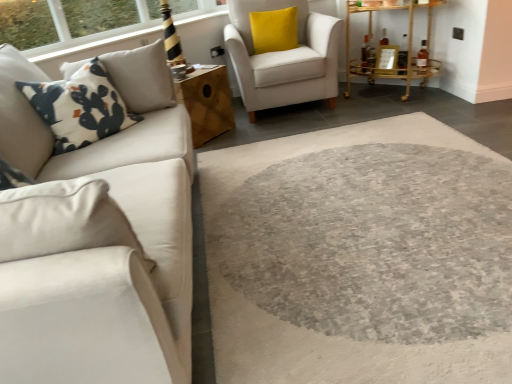
Question: In which direction should I rotate to look at wooden cube at center, the second table positioned from the right?

Choices:
 (A) left
 (B) right

Answer: (A)

Question: Would you consider gold metallic bar cart at upper right, which ranks as the 1th table in right-to-left order, to be distant from yellow velvet pillow at upper right?

Choices:
 (A) no
 (B) yes

Answer: (A)

Question: Does gold metallic bar cart at upper right, which ranks as the 1th table in right-to-left order, have a smaller size compared to yellow velvet pillow at upper right?

Choices:
 (A) no
 (B) yes

Answer: (A)

Question: From the image's perspective, is gold metallic bar cart at upper right, positioned as the 2th table in left-to-right order, under yellow velvet pillow at upper right?

Choices:
 (A) yes
 (B) no

Answer: (A)

Question: From the image's perspective, is gold metallic bar cart at upper right, positioned as the 2th table in left-to-right order, on top of yellow velvet pillow at upper right?

Choices:
 (A) no
 (B) yes

Answer: (A)

Question: From a real-world perspective, is gold metallic bar cart at upper right, which ranks as the 1th table in right-to-left order, located higher than yellow velvet pillow at upper right?

Choices:
 (A) no
 (B) yes

Answer: (A)

Question: Is gold metallic bar cart at upper right, which ranks as the 1th table in right-to-left order, closer to the viewer compared to yellow velvet pillow at upper right?

Choices:
 (A) no
 (B) yes

Answer: (B)

Question: Is wooden cube at center, the second table positioned from the right, at the left side of yellow velvet pillow at upper right?

Choices:
 (A) no
 (B) yes

Answer: (B)

Question: From a real-world perspective, is wooden cube at center, the 1th table in the left-to-right sequence, physically above yellow velvet pillow at upper right?

Choices:
 (A) no
 (B) yes

Answer: (A)

Question: Can you confirm if wooden cube at center, the second table positioned from the right, is wider than yellow velvet pillow at upper right?

Choices:
 (A) yes
 (B) no

Answer: (A)

Question: Can you confirm if wooden cube at center, the second table positioned from the right, is bigger than yellow velvet pillow at upper right?

Choices:
 (A) yes
 (B) no

Answer: (A)

Question: From the image's perspective, is wooden cube at center, the 1th table in the left-to-right sequence, over yellow velvet pillow at upper right?

Choices:
 (A) yes
 (B) no

Answer: (B)

Question: Is the depth of wooden cube at center, the second table positioned from the right, less than that of yellow velvet pillow at upper right?

Choices:
 (A) yes
 (B) no

Answer: (A)

Question: Would you consider white printed fabric pillow at left to be distant from yellow velvet pillow at upper right?

Choices:
 (A) no
 (B) yes

Answer: (B)